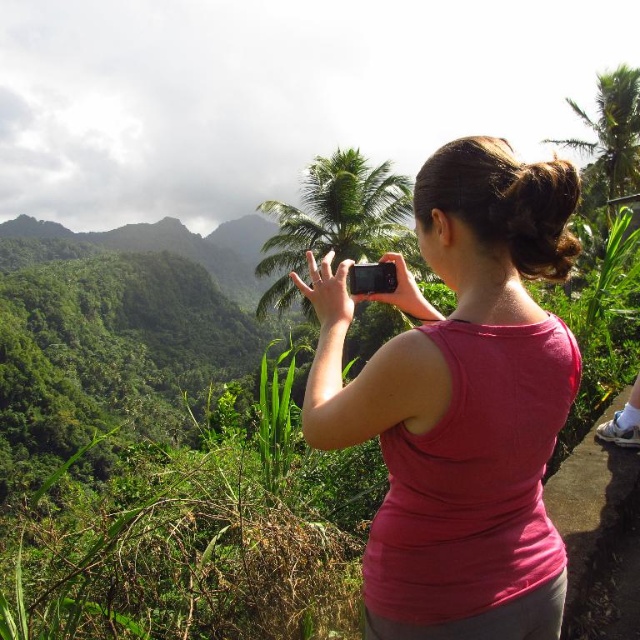
Question: Which point is closer to the camera taking this photo?

Choices:
 (A) (632, 106)
 (B) (378, 170)
 (C) (348, 444)

Answer: (C)

Question: Does pink fabric shirt at center lie behind green leafy palm tree at center?

Choices:
 (A) no
 (B) yes

Answer: (A)

Question: Which point is farther from the camera taking this photo?

Choices:
 (A) (595, 128)
 (B) (412, 432)
 (C) (380, 252)

Answer: (A)

Question: Considering the relative positions of pink fabric shirt at center and green leafy palm tree at center in the image provided, where is pink fabric shirt at center located with respect to green leafy palm tree at center?

Choices:
 (A) above
 (B) below

Answer: (B)

Question: Considering the real-world distances, which object is closest to the green leafy palm tree at center?

Choices:
 (A) pink fabric shirt at center
 (B) green leafy palm tree at upper right

Answer: (B)

Question: Does pink fabric shirt at center have a lesser width compared to green leafy palm tree at upper right?

Choices:
 (A) no
 (B) yes

Answer: (B)